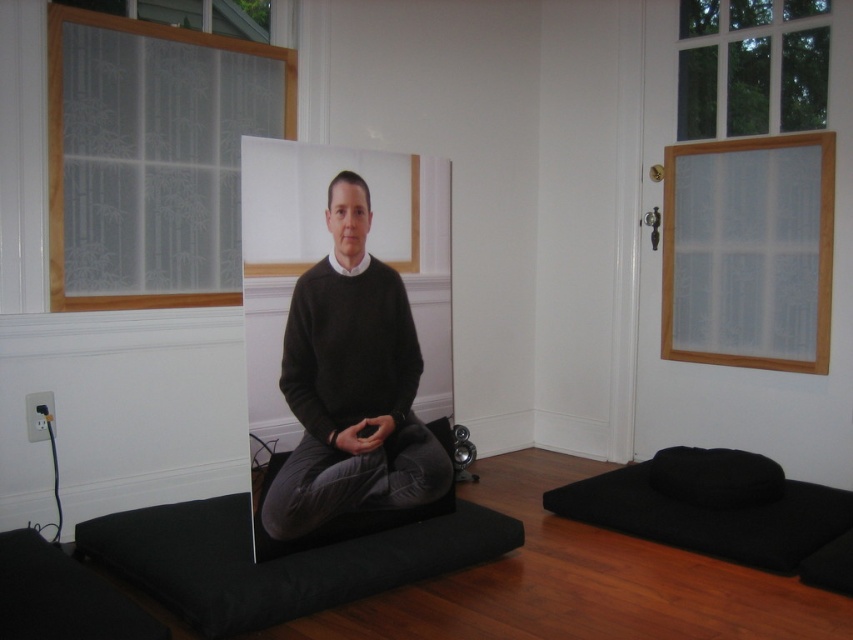
You are an interior designer arranging items on a shelf. You have a black matte mat at lower right and a black fabric pillow at lower right. According to the scene, which item is located to the left of the other?

The black matte mat at lower right is positioned on the left side of the black fabric pillow at lower right.

You are standing at a point 8.27 feet away from the point marked at coordinates (346, 467) in the image. The scene shows a meditative portrait on a black base near two frosted windows with bamboo patterns. Can you estimate how far you are from the portrait?

The point marked at coordinates (346, 467) is 8.27 feet away from the camera. Since the portrait is mounted on a black rectangular base near this point, you are approximately 8.27 feet away from the portrait.

Looking at this image, you are an interior designer arranging a minimalist living room. You have a black matte sweater at center and a black fabric pillow at lower right. Based on their positions, which object is closer to the left side of the room?

The black matte sweater at center is closer to the left side of the room because it is positioned to the left of the black fabric pillow at lower right.